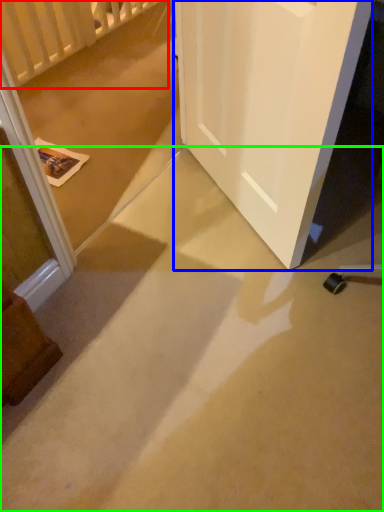
Question: Which is farther away from balustrade (highlighted by a red box)? door (highlighted by a blue box) or concrete (highlighted by a green box)?

Choices:
 (A) door
 (B) concrete

Answer: (B)